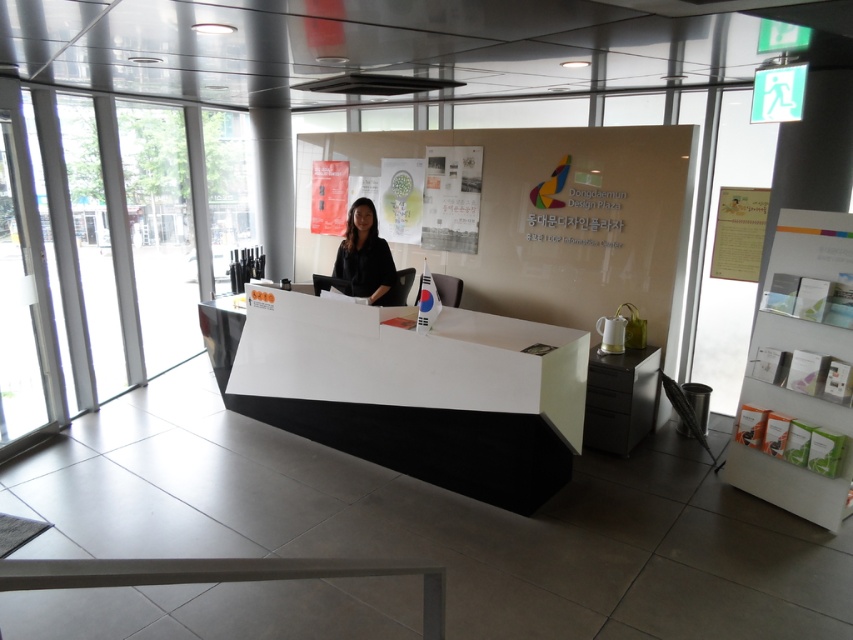
Who is lower down, white glossy reception desk at center or black matte shirt at center?

white glossy reception desk at center

This screenshot has height=640, width=853. Describe the element at coordinates (407, 388) in the screenshot. I see `white glossy reception desk at center` at that location.

At what (x,y) coordinates should I click in order to perform the action: click on white glossy reception desk at center. Please return your answer as a coordinate pair (x, y). The width and height of the screenshot is (853, 640). Looking at the image, I should click on (407, 388).